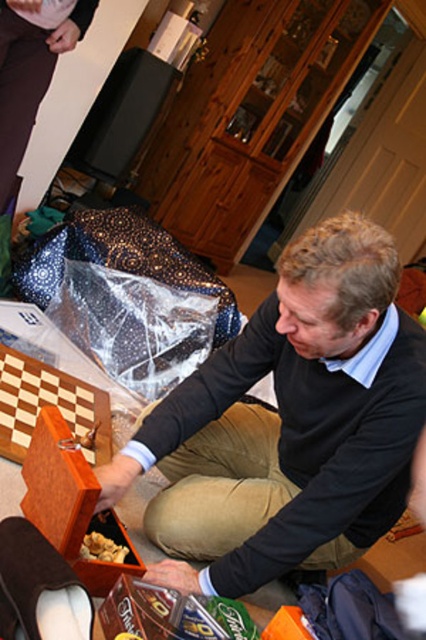
Is matte black sweater at center behind wooden box at center?

No.

Who is shorter, matte black sweater at center or wooden box at center?

Standing shorter between the two is wooden box at center.

Who is more distant from viewer, (268, 422) or (69, 540)?

The point (268, 422) is behind.

Where is `matte black sweater at center`? matte black sweater at center is located at coordinates (290, 422).

Which is more to the left, wooden box at center or brown crumbly food at lower center?

wooden box at center is more to the left.

Does point (88, 515) come farther from viewer compared to point (85, 554)?

No, it is not.

Who is more forward, (69, 486) or (98, 534)?

Point (69, 486)

Locate an element on the screen. The image size is (426, 640). wooden box at center is located at coordinates (71, 502).

Who is positioned more to the right, wooden box at center or wooden chess at lower left?

From the viewer's perspective, wooden box at center appears more on the right side.

Is wooden box at center smaller than wooden chess at lower left?

Yes, wooden box at center is smaller than wooden chess at lower left.

At what (x,y) coordinates should I click in order to perform the action: click on wooden box at center. Please return your answer as a coordinate pair (x, y). The image size is (426, 640). Looking at the image, I should click on (71, 502).